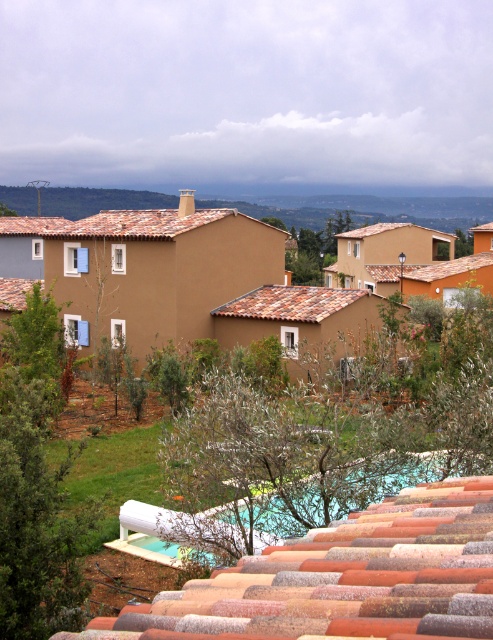
Question: Is terracotta tile roof at center thinner than brown clay tiles at left?

Choices:
 (A) no
 (B) yes

Answer: (A)

Question: Which object appears farthest from the camera in this image?

Choices:
 (A) brown clay tiles at left
 (B) terracotta tiles at center
 (C) green leafy tree at center
 (D) terracotta tile roof at center

Answer: (A)

Question: Which point is farther from the camera taking this photo?

Choices:
 (A) (2, 282)
 (B) (338, 294)
 (C) (354, 593)
 (D) (18, 312)

Answer: (A)

Question: Is green leafy tree at lower left positioned at the back of green leafy tree at left?

Choices:
 (A) yes
 (B) no

Answer: (B)

Question: Can you confirm if green leafy tree at lower left is positioned above brown clay tiles at left?

Choices:
 (A) no
 (B) yes

Answer: (A)

Question: Which point is closer to the camera taking this photo?

Choices:
 (A) (57, 346)
 (B) (10, 280)
 (C) (382, 500)
 (D) (214, 522)

Answer: (C)